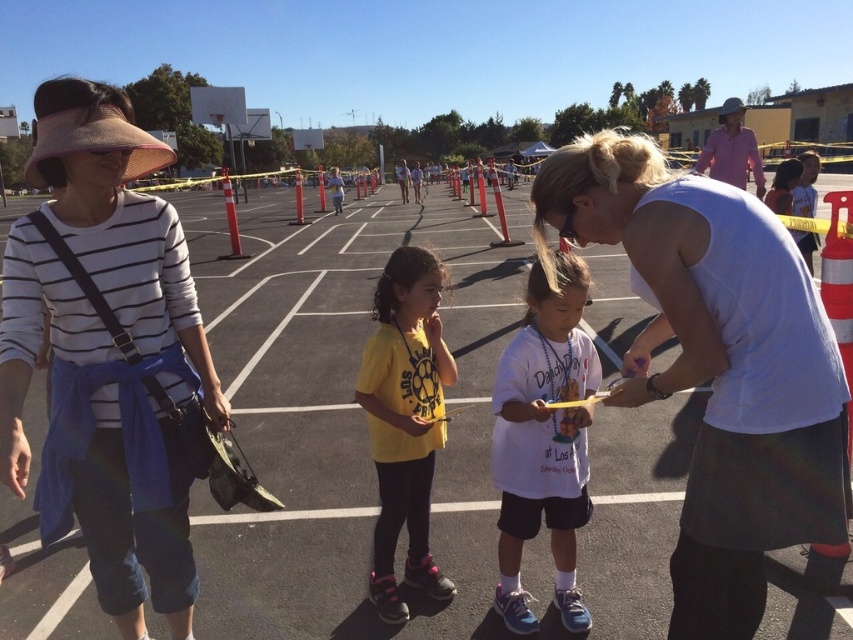
You are a delivery person who needs to place a box on the ground. The box is 30 cm tall. You see the asphalt at center and the white matte shirt at center in the scene. Can the box be placed on either of these surfaces without toppling over?

The asphalt at center has a greater height compared to white matte shirt at center. Since the box is 30 cm tall, it can be placed on the asphalt at center as it is higher, but the white matte shirt at center is lower and might not provide a stable base. However, placing items on someone else clothing is not advisable.

You are standing at the edge of the parking lot and see the asphalt at center and the yellow matte shirt at center. Which object is closer to your left side?

The yellow matte shirt at center is closer to your left side because the asphalt at center is to the right of it.

You are a photographer trying to capture a candid shot of the two children in the scene. The children are wearing a white cotton shirt at center and a yellow matte shirt at center. Which child should you focus on first if you want to photograph the one closer to the camera?

The white cotton shirt at center is above the yellow matte shirt at center, so focusing on the white cotton shirt at center would capture the child closer to the camera first.